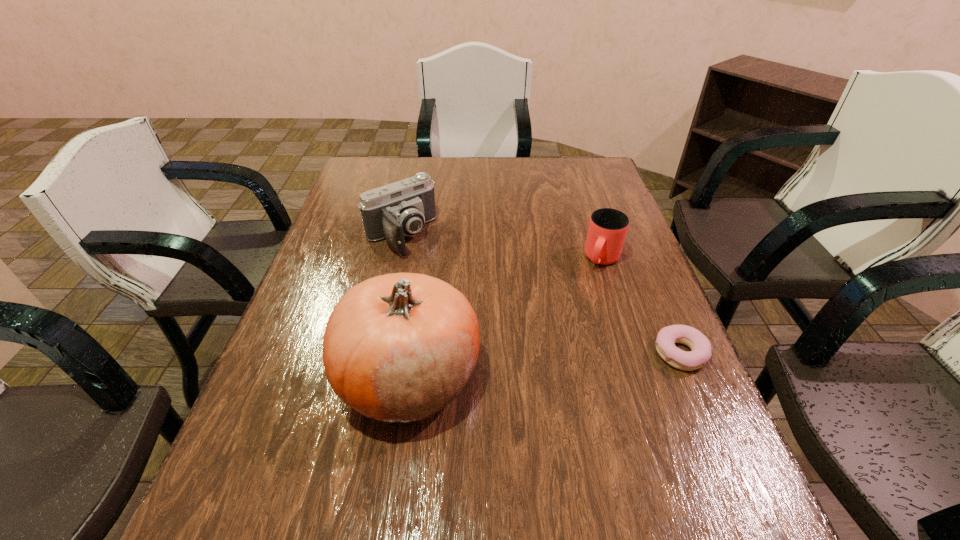
Image resolution: width=960 pixels, height=540 pixels. Identify the location of free space on the desktop that is between the tallest object and the doughnut and is positioned at the front of the second tallest object with an open lens cover. (522, 367).

Where is `vacant space on the desktop that is between the pumpkin and the doughnut and is positioned on the handle side of the second shortest object`? The image size is (960, 540). vacant space on the desktop that is between the pumpkin and the doughnut and is positioned on the handle side of the second shortest object is located at coordinates (549, 364).